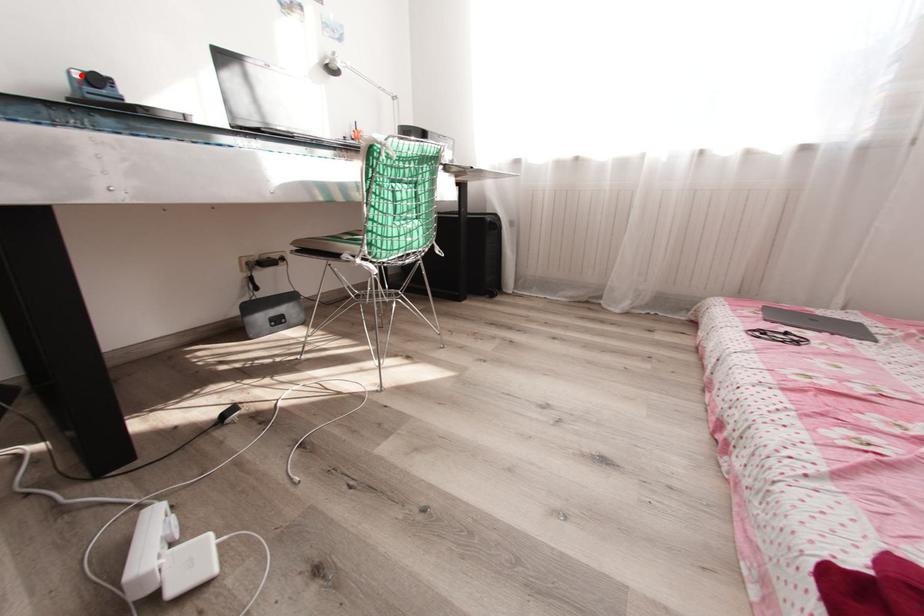
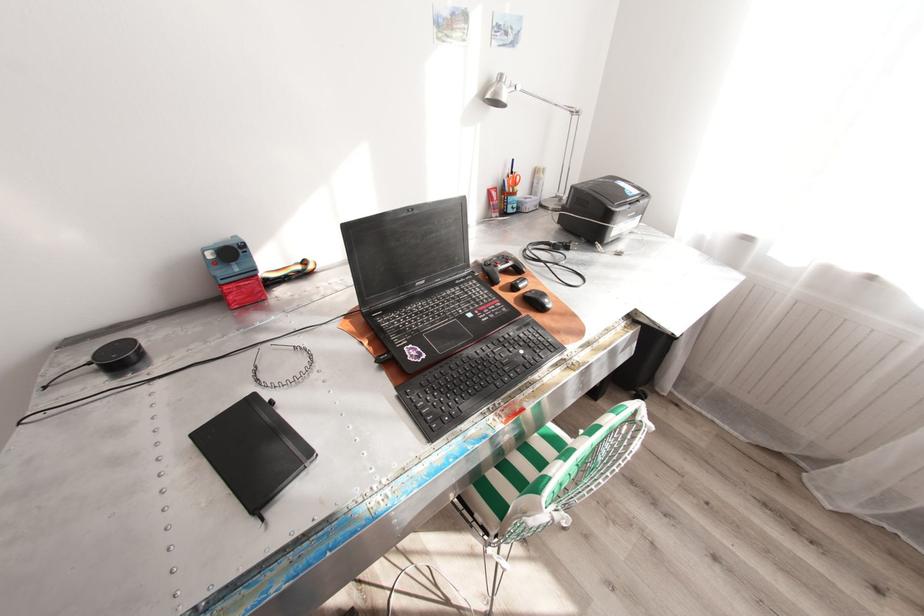
Question: I am providing you with two images of the same scene from different viewpoints. A red point is marked on the first image. Can you still see the location of the red point in image 2?

Choices:
 (A) Yes
 (B) No

Answer: (A)